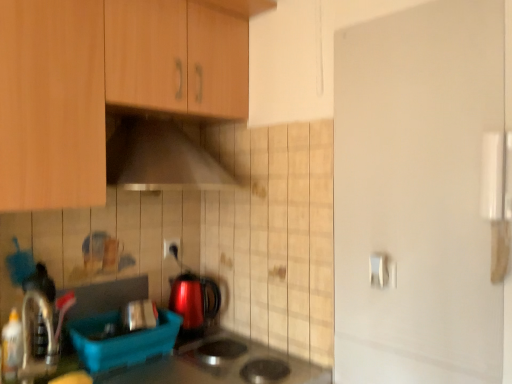
In the scene shown: In order to face translucent plastic bottle at lower left, should I rotate leftwards or rightwards?

A 29.707 degree turn to the left will do.

What is the approximate width of metallic silver toaster at lower center, the first appliance from the back?

It is 5.01 inches.

This screenshot has width=512, height=384. In order to click on metallic silver range hood at upper center in this screenshot , I will do `click(160, 159)`.

Image resolution: width=512 pixels, height=384 pixels. What do you see at coordinates (170, 247) in the screenshot? I see `white plastic electric outlet at center` at bounding box center [170, 247].

The width and height of the screenshot is (512, 384). I want to click on blue plastic container at lower left, the second appliance when ordered from back to front, so click(x=122, y=341).

Describe the element at coordinates (122, 341) in the screenshot. Image resolution: width=512 pixels, height=384 pixels. I see `blue plastic container at lower left, which ranks as the 1th appliance in front-to-back order` at that location.

What is the approximate height of glossy metallic kettle at center?

The height of glossy metallic kettle at center is 9.50 inches.

This screenshot has height=384, width=512. What do you see at coordinates (382, 271) in the screenshot?
I see `white glossy door handle at upper right` at bounding box center [382, 271].

At what (x,y) coordinates should I click in order to perform the action: click on translucent plastic bottle at lower left. Please return your answer as a coordinate pair (x, y). Looking at the image, I should click on (12, 346).

Where is `kitchen appliance located on the right of white plastic electric outlet at center`? kitchen appliance located on the right of white plastic electric outlet at center is located at coordinates (194, 302).

Is glossy metallic kettle at center positioned beyond the bounds of white plastic electric outlet at center?

Yes, glossy metallic kettle at center is not within white plastic electric outlet at center.

Can you confirm if glossy metallic kettle at center is taller than white plastic electric outlet at center?

Yes, glossy metallic kettle at center is taller than white plastic electric outlet at center.

From a real-world perspective, who is located lower, glossy metallic kettle at center or white plastic electric outlet at center?

From a 3D spatial view, glossy metallic kettle at center is below.

Which point is more forward, (x=131, y=351) or (x=178, y=309)?

The point (x=131, y=351) is more forward.

Is blue plastic container at lower left, the second appliance when ordered from back to front, completely or partially outside of glossy metallic kettle at center?

blue plastic container at lower left, the second appliance when ordered from back to front, lies outside glossy metallic kettle at center's area.

From the picture: Between blue plastic container at lower left, the second appliance when ordered from back to front, and glossy metallic kettle at center, which one has more height?

With more height is glossy metallic kettle at center.

Considering the relative positions of blue plastic container at lower left, the second appliance when ordered from back to front, and glossy metallic kettle at center in the image provided, is blue plastic container at lower left, the second appliance when ordered from back to front, to the left of glossy metallic kettle at center from the viewer's perspective?

Correct, you'll find blue plastic container at lower left, the second appliance when ordered from back to front, to the left of glossy metallic kettle at center.

Which object is positioned more to the left, wooden cabinet at upper left or blue plastic container at lower left, which ranks as the 1th appliance in front-to-back order?

blue plastic container at lower left, which ranks as the 1th appliance in front-to-back order, is more to the left.

Find the location of `cabinetry to the right of blue plastic container at lower left, the second appliance when ordered from back to front`. cabinetry to the right of blue plastic container at lower left, the second appliance when ordered from back to front is located at coordinates (106, 83).

Consider the image. Considering the relative sizes of wooden cabinet at upper left and blue plastic container at lower left, the second appliance when ordered from back to front, in the image provided, is wooden cabinet at upper left smaller than blue plastic container at lower left, the second appliance when ordered from back to front,?

No.

From the image's perspective, does wooden cabinet at upper left appear higher than blue plastic container at lower left, the second appliance when ordered from back to front?

Correct, wooden cabinet at upper left appears higher than blue plastic container at lower left, the second appliance when ordered from back to front, in the image.

From a real-world perspective, which is physically below, translucent plastic bottle at lower left or white glossy door handle at upper right?

translucent plastic bottle at lower left, from a real-world perspective.

Considering the sizes of translucent plastic bottle at lower left and white glossy door handle at upper right in the image, is translucent plastic bottle at lower left bigger or smaller than white glossy door handle at upper right?

translucent plastic bottle at lower left is bigger than white glossy door handle at upper right.

Would you say white glossy door handle at upper right is part of translucent plastic bottle at lower left's contents?

Actually, white glossy door handle at upper right is outside translucent plastic bottle at lower left.

Between translucent plastic bottle at lower left and white glossy door handle at upper right, which one has larger width?

With larger width is translucent plastic bottle at lower left.

Which is farther, (4, 376) or (184, 294)?

The point (184, 294) is more distant.

Can you confirm if translucent plastic bottle at lower left is taller than glossy metallic kettle at center?

Incorrect, the height of translucent plastic bottle at lower left is not larger of that of glossy metallic kettle at center.

Is translucent plastic bottle at lower left spatially inside glossy metallic kettle at center, or outside of it?

translucent plastic bottle at lower left is not enclosed by glossy metallic kettle at center.

Is glossy metallic kettle at center turned away from metallic silver toaster at lower center, the first appliance from the back?

No, metallic silver toaster at lower center, the first appliance from the back, is not at the back of glossy metallic kettle at center.

Can you confirm if glossy metallic kettle at center is taller than metallic silver toaster at lower center, the first appliance from the back?

Yes, glossy metallic kettle at center is taller than metallic silver toaster at lower center, the first appliance from the back.

Can you confirm if glossy metallic kettle at center is positioned to the left of metallic silver toaster at lower center, which is the second appliance in front-to-back order?

In fact, glossy metallic kettle at center is to the right of metallic silver toaster at lower center, which is the second appliance in front-to-back order.

Between point (173, 293) and point (142, 325), which one is positioned in front?

Positioned in front is point (142, 325).

Is glossy metallic kettle at center positioned far away from white glossy door handle at upper right?

Actually, glossy metallic kettle at center and white glossy door handle at upper right are a little close together.

The height and width of the screenshot is (384, 512). Identify the location of door handle on the right of glossy metallic kettle at center. (382, 271).

Is glossy metallic kettle at center oriented away from white glossy door handle at upper right?

No.

The image size is (512, 384). In order to click on kitchen appliance in front of the white plastic electric outlet at center in this screenshot , I will do `click(194, 302)`.

In order to click on the 2nd appliance to the left of the glossy metallic kettle at center, counting from the anchor's position in this screenshot , I will do (122, 341).

Based on their spatial positions, is translucent plastic bottle at lower left or white plastic electric outlet at center closer to glossy metallic kettle at center?

The object closer to glossy metallic kettle at center is white plastic electric outlet at center.

Consider the image. Based on their spatial positions, is metallic silver range hood at upper center or white glossy door handle at upper right closer to white plastic electric outlet at center?

metallic silver range hood at upper center is positioned closer to the anchor white plastic electric outlet at center.

From the image, which object appears to be nearer to blue plastic container at lower left, which ranks as the 1th appliance in front-to-back order, glossy metallic kettle at center or wooden cabinet at upper left?

Based on the image, glossy metallic kettle at center appears to be nearer to blue plastic container at lower left, which ranks as the 1th appliance in front-to-back order.

Estimate the real-world distances between objects in this image. Which object is further from white plastic electric outlet at center, metallic silver range hood at upper center or blue plastic container at lower left, the second appliance when ordered from back to front?

The object further to white plastic electric outlet at center is blue plastic container at lower left, the second appliance when ordered from back to front.

Looking at the image, which one is located closer to blue plastic container at lower left, which ranks as the 1th appliance in front-to-back order, translucent plastic bottle at lower left or metallic silver toaster at lower center, the first appliance from the back?

metallic silver toaster at lower center, the first appliance from the back, is positioned closer to the anchor blue plastic container at lower left, which ranks as the 1th appliance in front-to-back order.

When comparing their distances from translucent plastic bottle at lower left, does glossy metallic kettle at center or white plastic electric outlet at center seem further?

The object further to translucent plastic bottle at lower left is white plastic electric outlet at center.

Estimate the real-world distances between objects in this image. Which object is further from white plastic electric outlet at center, white glossy door handle at upper right or translucent plastic bottle at lower left?

white glossy door handle at upper right is further to white plastic electric outlet at center.

Looking at the image, which one is located closer to metallic silver range hood at upper center, white glossy door handle at upper right or blue plastic container at lower left, the second appliance when ordered from back to front?

blue plastic container at lower left, the second appliance when ordered from back to front, lies closer to metallic silver range hood at upper center than the other object.

The height and width of the screenshot is (384, 512). What are the coordinates of `home appliance between wooden cabinet at upper left and white plastic electric outlet at center along the z-axis` in the screenshot? It's located at (160, 159).

Where is `appliance between wooden cabinet at upper left and blue plastic container at lower left, the second appliance when ordered from back to front, vertically`? Image resolution: width=512 pixels, height=384 pixels. appliance between wooden cabinet at upper left and blue plastic container at lower left, the second appliance when ordered from back to front, vertically is located at coordinates (139, 315).

I want to click on kitchen appliance between wooden cabinet at upper left and white plastic electric outlet at center along the z-axis, so click(194, 302).

In order to click on electric outlet located between metallic silver toaster at lower center, which is the second appliance in front-to-back order, and white glossy door handle at upper right in the left-right direction in this screenshot , I will do `click(170, 247)`.